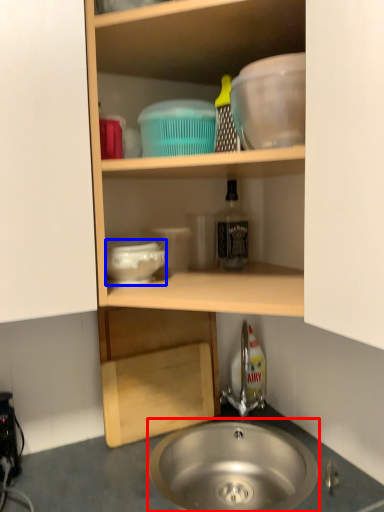
Question: Among these objects, which one is nearest to the camera, sink (highlighted by a red box) or basin (highlighted by a blue box)?

Choices:
 (A) sink
 (B) basin

Answer: (A)